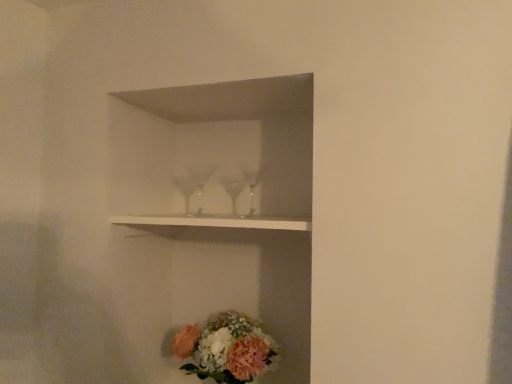
Question: Does pastel floral bouquet at lower center have a lesser width compared to white glossy shelf at upper center?

Choices:
 (A) no
 (B) yes

Answer: (B)

Question: Does pastel floral bouquet at lower center lie behind white glossy shelf at upper center?

Choices:
 (A) yes
 (B) no

Answer: (A)

Question: Can you confirm if pastel floral bouquet at lower center is wider than white glossy shelf at upper center?

Choices:
 (A) no
 (B) yes

Answer: (A)

Question: From a real-world perspective, is pastel floral bouquet at lower center over white glossy shelf at upper center?

Choices:
 (A) no
 (B) yes

Answer: (A)

Question: Is pastel floral bouquet at lower center at the right side of white glossy shelf at upper center?

Choices:
 (A) no
 (B) yes

Answer: (A)

Question: From a real-world perspective, is pastel floral bouquet at lower center physically below white glossy shelf at upper center?

Choices:
 (A) yes
 (B) no

Answer: (A)

Question: Does white glossy shelf at upper center lie in front of pastel floral bouquet at lower center?

Choices:
 (A) no
 (B) yes

Answer: (B)

Question: Is white glossy shelf at upper center next to pastel floral bouquet at lower center?

Choices:
 (A) yes
 (B) no

Answer: (B)

Question: Does white glossy shelf at upper center have a greater height compared to pastel floral bouquet at lower center?

Choices:
 (A) yes
 (B) no

Answer: (B)

Question: From the image's perspective, would you say white glossy shelf at upper center is shown under pastel floral bouquet at lower center?

Choices:
 (A) yes
 (B) no

Answer: (B)

Question: Is pastel floral bouquet at lower center completely or partially inside white glossy shelf at upper center?

Choices:
 (A) no
 (B) yes

Answer: (A)

Question: Would you say white glossy shelf at upper center is a long distance from pastel floral bouquet at lower center?

Choices:
 (A) yes
 (B) no

Answer: (B)

Question: From the image's perspective, relative to white glossy shelf at upper center, is pastel floral bouquet at lower center above or below?

Choices:
 (A) below
 (B) above

Answer: (A)